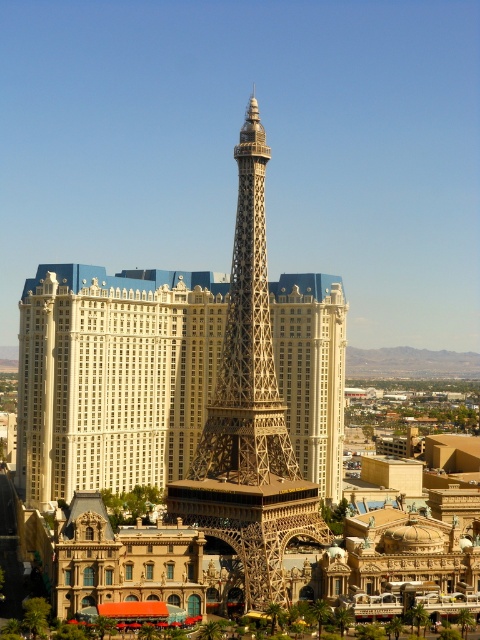
You are standing at the entrance of the hotel and see two points marked in the scene. The first point is at coordinate point (75,353) and the second is at point (253,573). Which point is closer to you as you face the hotel entrance?

Point (253,573) is closer to you because it is in front of point (75,353).

Consider the image. You are an architect reviewing a design blueprint for a hotel that incorporates the Eiffel Tower. The blueprint shows two versions of the Eiffel Tower design labeled as gold metallic eiffel tower at center and metallic gold eiffel tower at center. Which version should you choose if you want the tower to have a more imposing presence in the hotel layout?

The gold metallic eiffel tower at center should be chosen because its width is larger than the metallic gold eiffel tower at center, making it more imposing in the hotel layout.

You are standing in front of the hotel building and want to locate the gold metallic eiffel tower at center. Based on its coordinates, where should you look relative to the center of the image?

The gold metallic eiffel tower at center is located at coordinates approximately 59 percent to the right and 24 percent down from the top left corner of the image.